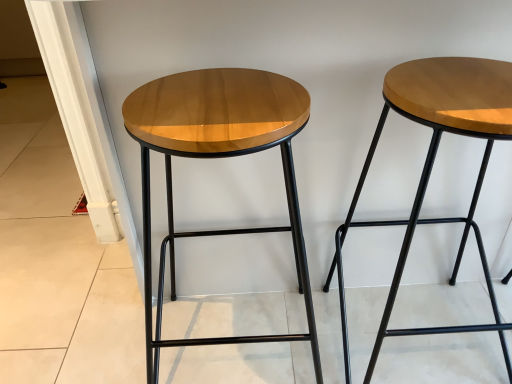
Locate an element on the screen. vacant space that's between glossy wood stool at left, placed as the second stool when sorted from right to left, and glossy wood stool at right, which ranks as the second stool in left-to-right order is located at coordinates (323, 324).